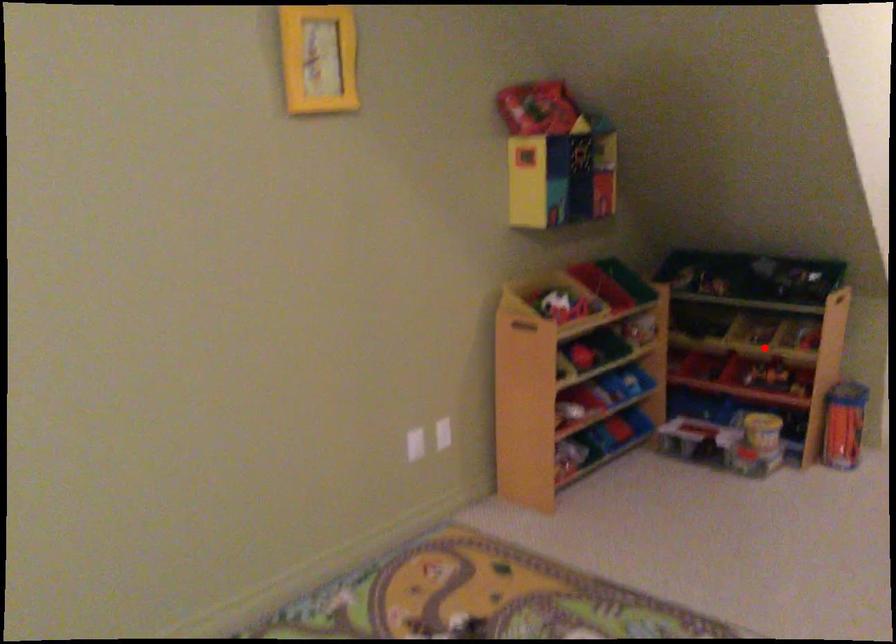
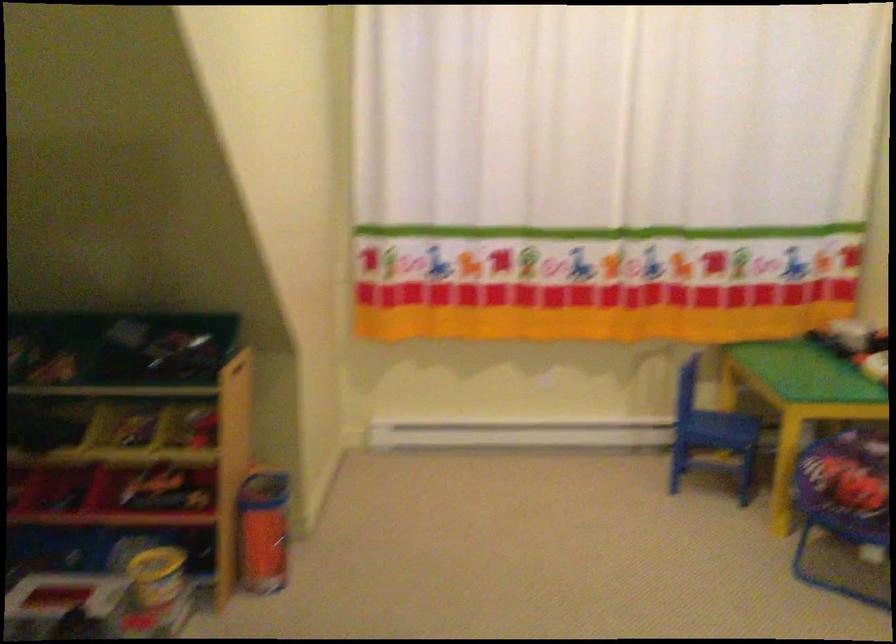
Locate, in the second image, the point that corresponds to the highlighted location in the first image.

(145, 457)